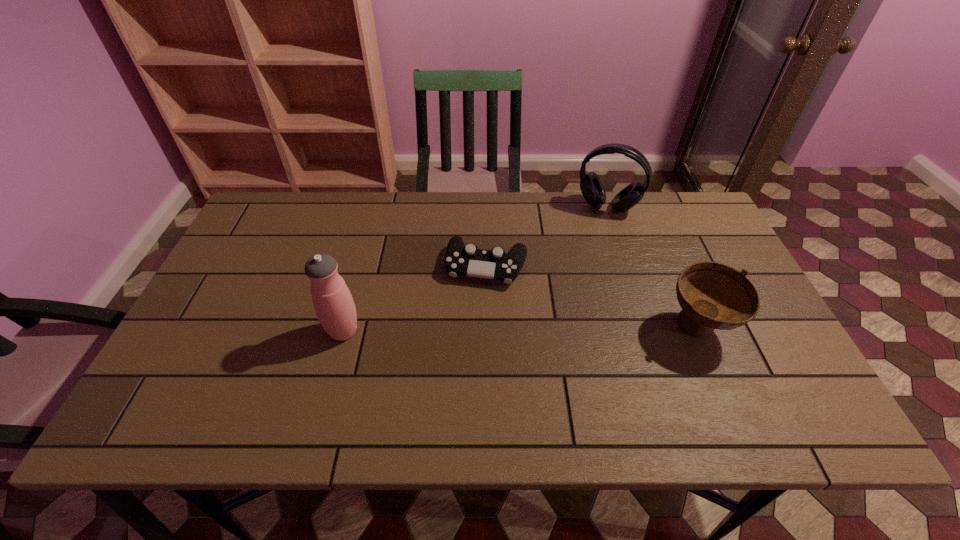
You are a GUI agent. You are given a task and a screenshot of the screen. Output one action in this format:
    pyautogui.click(x=<x>, y=<y>)
    Task: Click on the free space located on the earcups of the farthest object
    This screenshot has width=960, height=540.
    Given the screenshot: What is the action you would take?
    pyautogui.click(x=586, y=254)

Identify the location of free region located on the surface of the shortest object. (472, 324).

Find the location of a particular element. This screenshot has height=540, width=960. vacant region located on the surface of the shortest object is located at coordinates (477, 303).

Where is `free space located 0.230m on the surface of the shortest object`? This screenshot has width=960, height=540. free space located 0.230m on the surface of the shortest object is located at coordinates (464, 361).

This screenshot has width=960, height=540. Identify the location of object positioned at the far edge. (591, 186).

Locate an element on the screen. object located at the right edge is located at coordinates (712, 295).

The height and width of the screenshot is (540, 960). What are the coordinates of `vacant space at the far edge` in the screenshot? It's located at (368, 203).

Locate an element on the screen. This screenshot has width=960, height=540. vacant area at the left edge of the desktop is located at coordinates (244, 259).

Locate an element on the screen. The height and width of the screenshot is (540, 960). vacant region at the right edge of the desktop is located at coordinates (711, 346).

Locate an element on the screen. Image resolution: width=960 pixels, height=540 pixels. vacant space at the far left corner of the desktop is located at coordinates (291, 231).